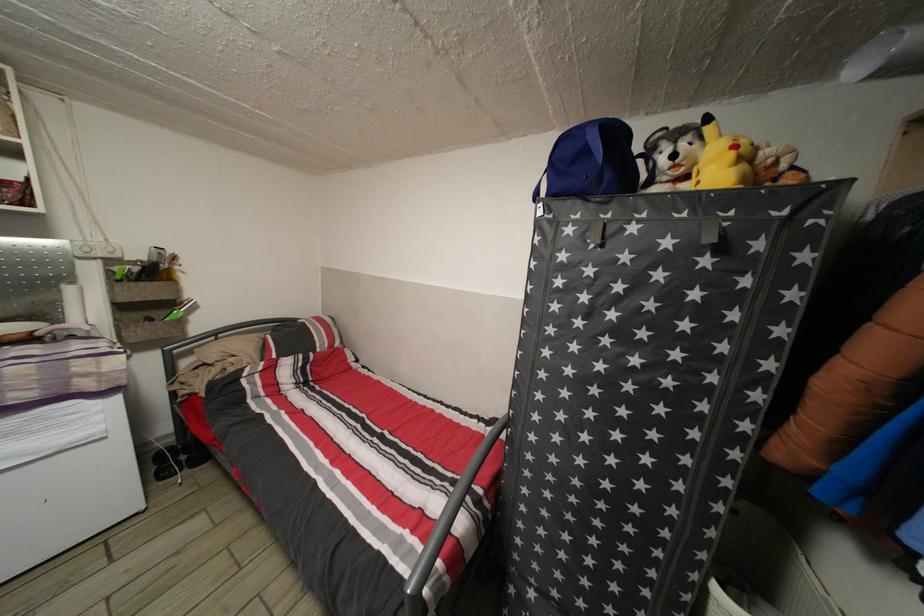
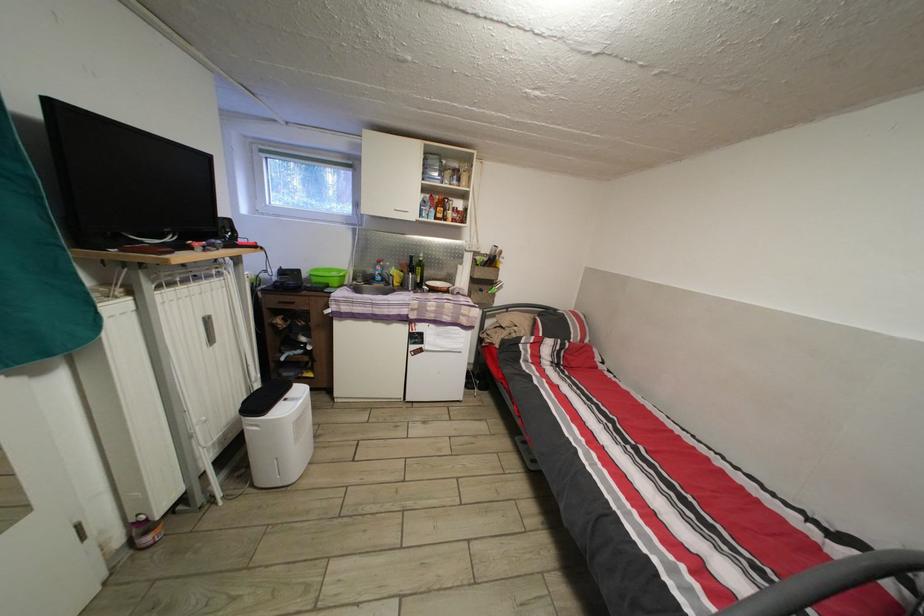
Question: The images are taken continuously from a first-person perspective. In which direction is your viewpoint rotating?

Choices:
 (A) Left
 (B) Right
 (C) Up
 (D) Down

Answer: (A)